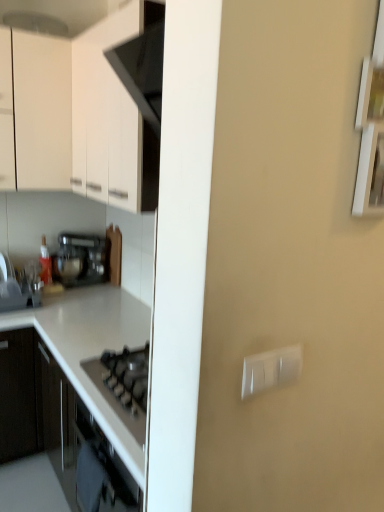
Question: From a real-world perspective, is white plastic switch at right above or below satin black toaster at left?

Choices:
 (A) above
 (B) below

Answer: (A)

Question: Considering their positions, is white plastic switch at right located in front of or behind satin black toaster at left?

Choices:
 (A) behind
 (B) front

Answer: (B)

Question: Which of these objects is positioned farthest from the white matte cabinet at upper left?

Choices:
 (A) white plastic switch at right
 (B) satin black toaster at left
 (C) white glossy countertop at lower left

Answer: (A)

Question: Which of these objects is positioned farthest from the satin black toaster at left?

Choices:
 (A) white glossy countertop at lower left
 (B) white plastic switch at right
 (C) white matte cabinet at upper left

Answer: (B)